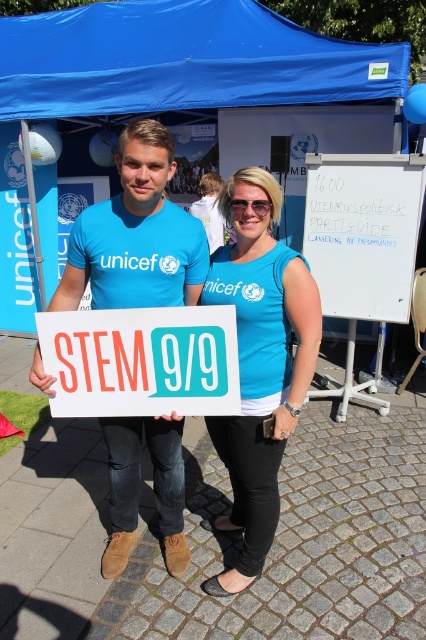
Based on the photo, is blue fabric tent at upper center wider than blue fabric canopy at upper center?

Yes.

Is point (405, 48) less distant than point (31, 100)?

Yes, point (405, 48) is closer to viewer.

Between point (103, 58) and point (63, 33), which one is positioned behind?

Point (63, 33)

I want to click on blue fabric tent at upper center, so click(183, 64).

Is blue fabric sign at center taller than white paper sign at center?

Correct, blue fabric sign at center is much taller as white paper sign at center.

Who is taller, blue fabric sign at center or white paper sign at center?

With more height is blue fabric sign at center.

This screenshot has height=640, width=426. What do you see at coordinates (259, 365) in the screenshot?
I see `blue fabric sign at center` at bounding box center [259, 365].

What are the coordinates of `blue fabric sign at center` in the screenshot? It's located at (259, 365).

Is blue fabric tent at upper center above matte blue tank top at center?

Indeed, blue fabric tent at upper center is positioned over matte blue tank top at center.

Is blue fabric tent at upper center closer to the viewer compared to matte blue tank top at center?

No, it is not.

Find the location of `blue fabric tent at upper center`. blue fabric tent at upper center is located at coordinates (183, 64).

The image size is (426, 640). In order to click on blue fabric tent at upper center in this screenshot , I will do `click(183, 64)`.